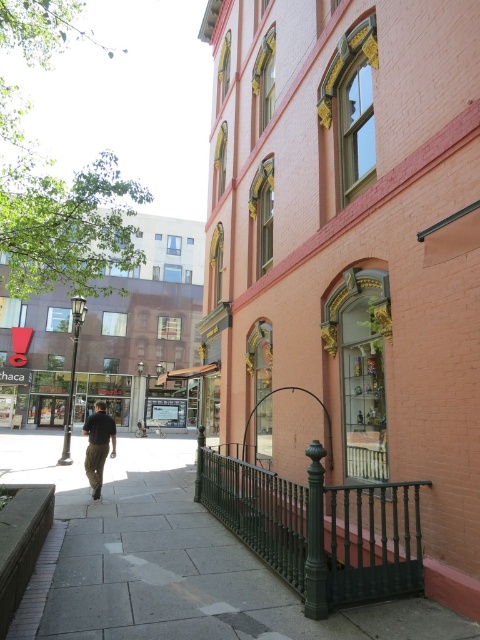
Question: Does gray concrete sidewalk at lower left appear over dark brown pants at center?

Choices:
 (A) yes
 (B) no

Answer: (A)

Question: Can you confirm if gray concrete sidewalk at lower left is positioned below dark brown pants at center?

Choices:
 (A) yes
 (B) no

Answer: (B)

Question: Which object appears closest to the camera in this image?

Choices:
 (A) dark brown pants at center
 (B) gray concrete sidewalk at lower left

Answer: (B)

Question: Is gray concrete sidewalk at lower left positioned at the back of dark brown pants at center?

Choices:
 (A) no
 (B) yes

Answer: (A)